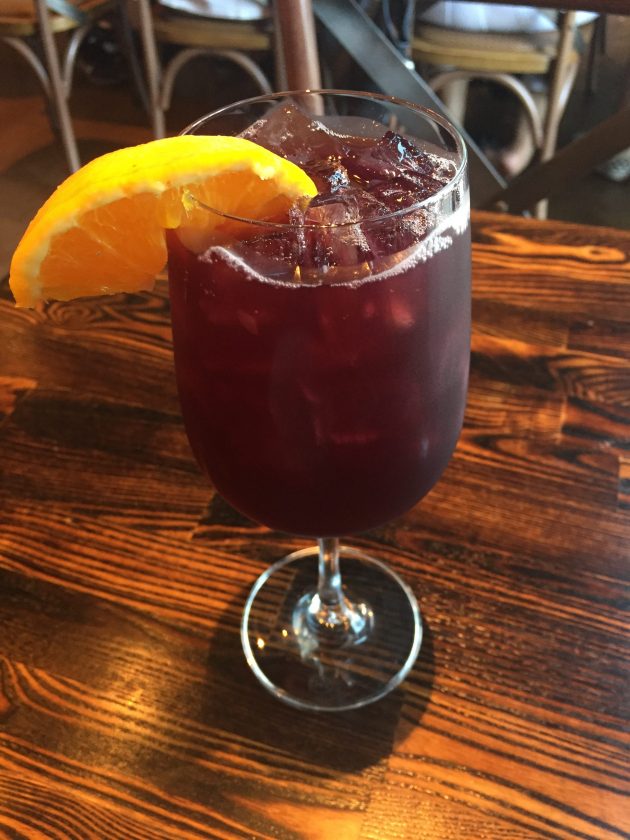
The height and width of the screenshot is (840, 630). In order to click on chairs in this screenshot , I will do `click(461, 56)`, `click(53, 18)`, `click(210, 42)`.